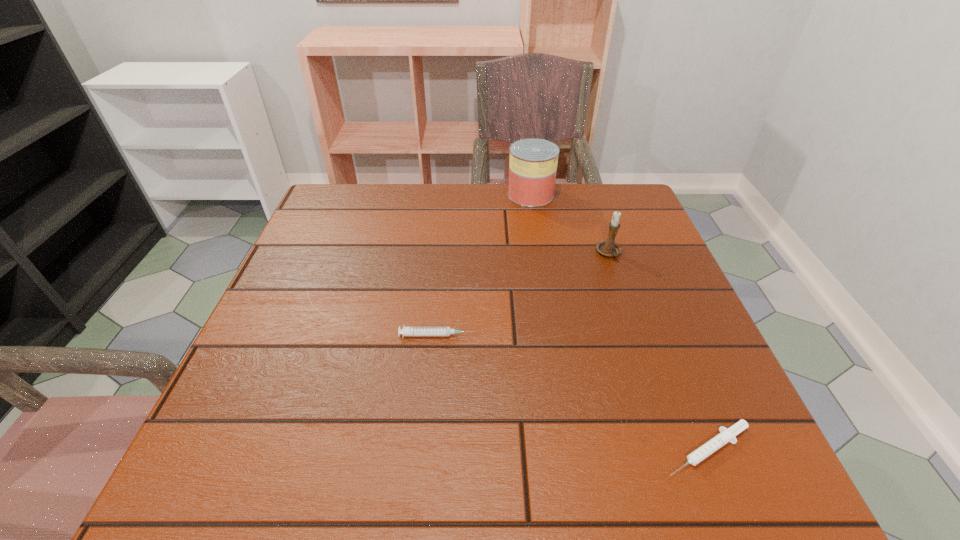
Find the location of a particular element. free space at the right edge of the desktop is located at coordinates (641, 284).

Where is `free space at the far right corner of the desktop`? Image resolution: width=960 pixels, height=540 pixels. free space at the far right corner of the desktop is located at coordinates (623, 184).

Image resolution: width=960 pixels, height=540 pixels. In the image, there is a desktop. In order to click on free region at the near right corner in this screenshot , I will do `click(769, 493)`.

Find the location of a particular element. This screenshot has height=540, width=960. free point between the shorter syringe and the farther syringe is located at coordinates (572, 393).

Where is `empty location between the left syringe and the shorter syringe`? This screenshot has width=960, height=540. empty location between the left syringe and the shorter syringe is located at coordinates (572, 393).

The width and height of the screenshot is (960, 540). Identify the location of free point between the right syringe and the tallest object. [619, 322].

You are a GUI agent. You are given a task and a screenshot of the screen. Output one action in this format:
    pyautogui.click(x=<x>, y=<y>)
    Task: Click on the empty location between the candle holder and the right syringe
    
    Given the screenshot: What is the action you would take?
    pyautogui.click(x=658, y=352)

Locate an element on the screen. vacant area that lies between the third nearest object and the farthest object is located at coordinates (570, 224).

Find the location of a particular element. empty space between the third shortest object and the shortest object is located at coordinates (658, 352).

This screenshot has width=960, height=540. What are the coordinates of `free space between the leftmost object and the third nearest object` in the screenshot? It's located at (523, 294).